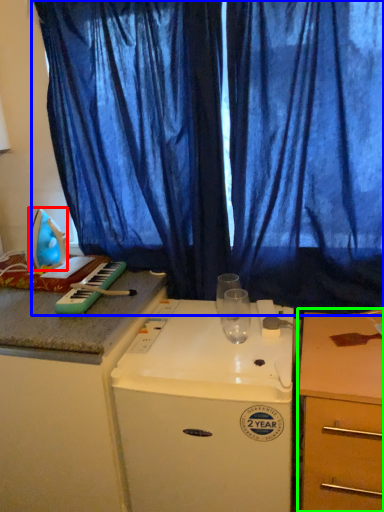
Question: Which object is positioned farthest from appliance (highlighted by a red box)? Select from curtain (highlighted by a blue box) and desk (highlighted by a green box).

Choices:
 (A) curtain
 (B) desk

Answer: (B)